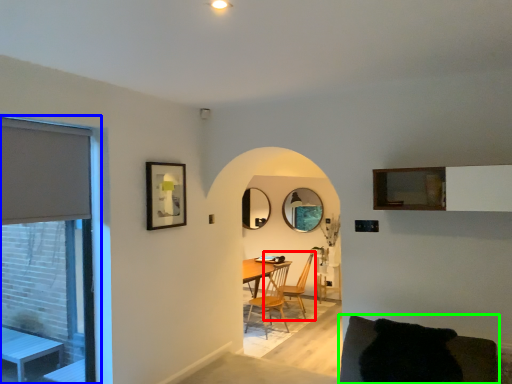
Question: Which object is the farthest from chair (highlighted by a red box)? Choose among these: window (highlighted by a blue box) or couch (highlighted by a green box).

Choices:
 (A) window
 (B) couch

Answer: (B)